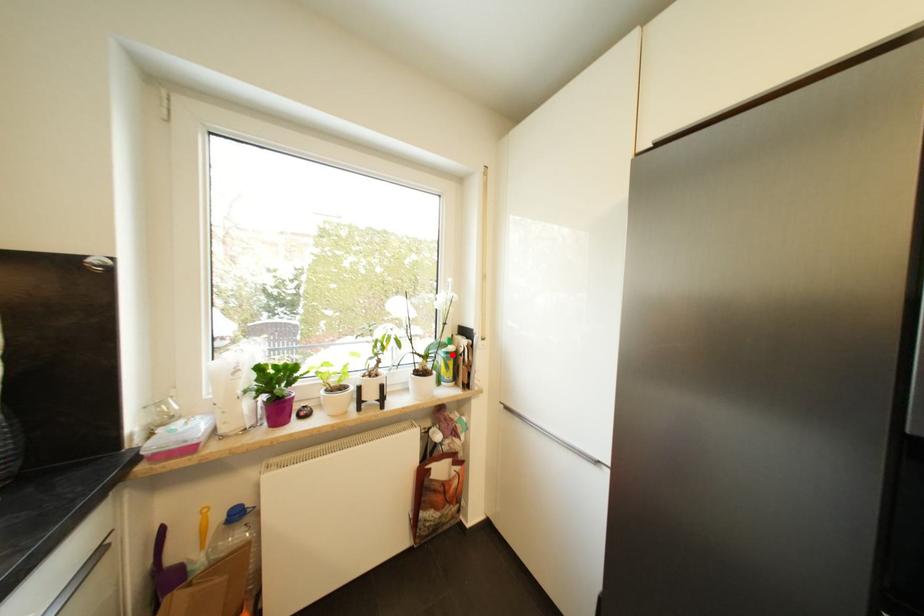
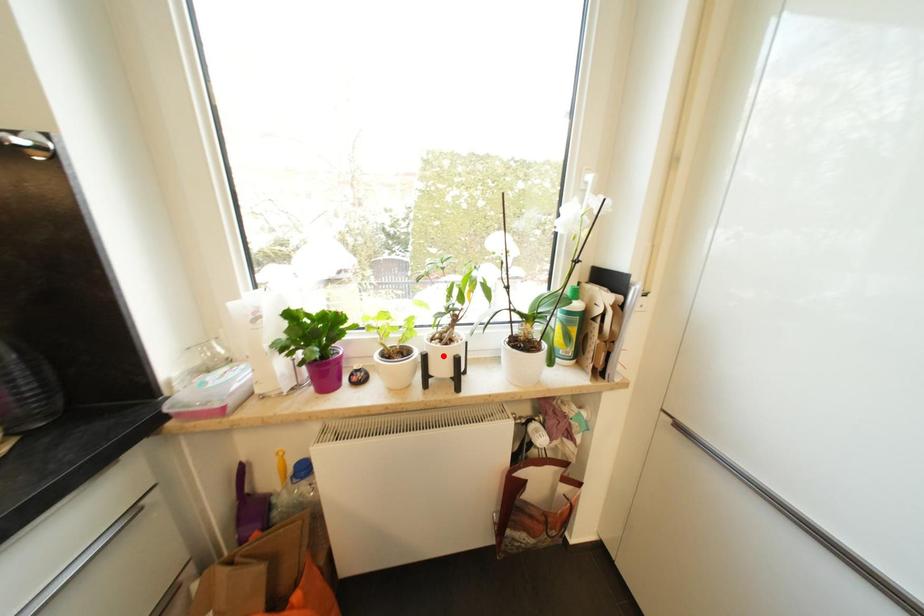
I am providing you with two images of the same scene from different viewpoints. A red point is marked on the first image and another point is marked on the second image. Are the points marked in image1 and image2 representing the same 3D position?

No